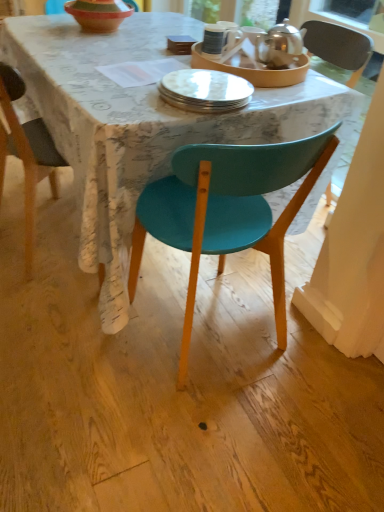
Identify the location of vacant space in front of terracotta clay bowl at upper center. This screenshot has height=512, width=384. (86, 42).